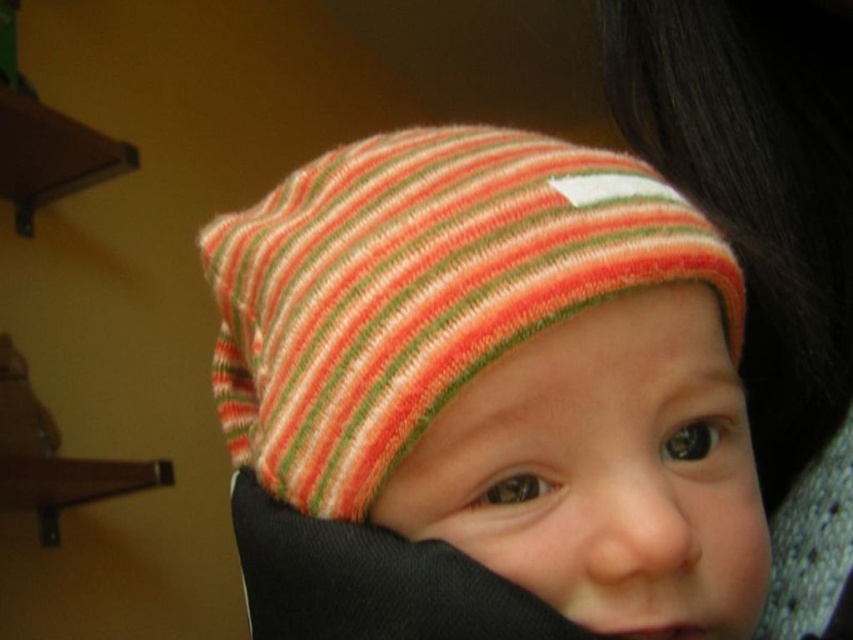
You are a photographer adjusting the focus on your camera. You notice two striped knit hats in the frame. Which one, the striped knit hat at center or the striped knit hat at upper center, is closer to the camera?

The striped knit hat at center is closer to the camera because it has a smaller size compared to the striped knit hat at upper center.

You are taking a photo of a baby wearing a striped hat. You notice two points in the image at coordinates point (248, 259) and point (838, 444). Which point is closer to the camera?

Point (248, 259) is in front of point (838, 444), so it is closer to the camera.